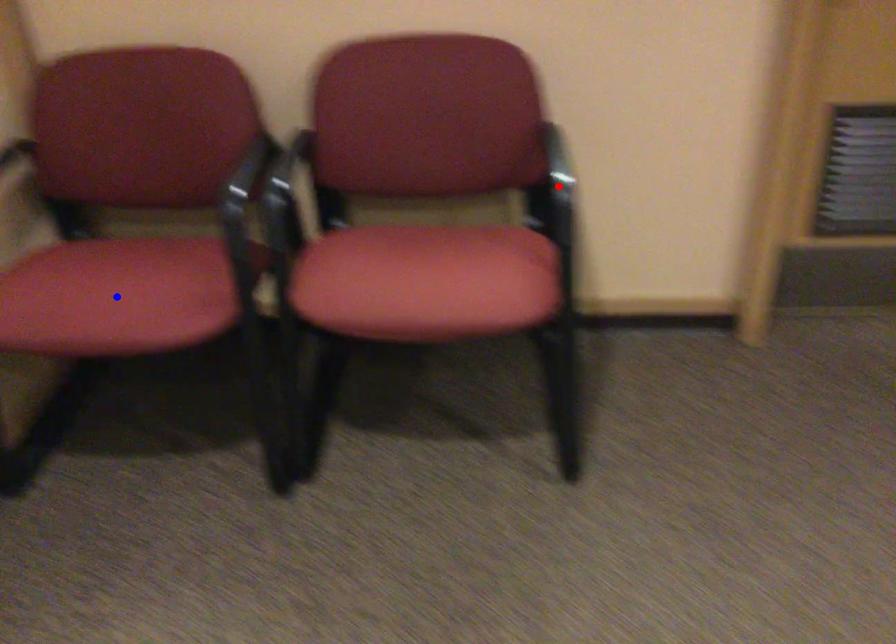
Question: Which of the two points in the image is closer to the camera?

Choices:
 (A) Blue point is closer.
 (B) Red point is closer.

Answer: (B)